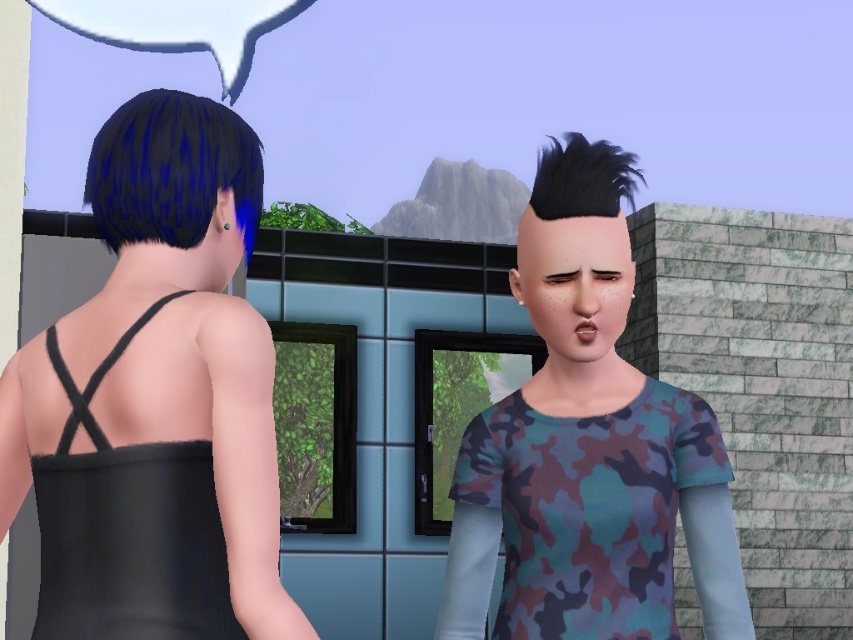
Question: Which object is the closest to the white paper speech bubble at upper center?

Choices:
 (A) black matte hair at upper center
 (B) blue shiny hair at back
 (C) camouflage fabric at center
 (D) black matte dress at left

Answer: (A)

Question: Which point appears farthest from the camera in this image?

Choices:
 (A) (598, 529)
 (B) (631, 616)
 (C) (222, 250)

Answer: (A)

Question: Does camouflage fabric at center appear on the right side of blue shiny hair at back?

Choices:
 (A) no
 (B) yes

Answer: (B)

Question: Does black matte dress at back have a smaller size compared to blue shiny hair at back?

Choices:
 (A) no
 (B) yes

Answer: (B)

Question: Based on their relative distances, which object is farther from the black matte hair at upper center?

Choices:
 (A) black matte dress at left
 (B) black matte dress at back

Answer: (B)

Question: Is camouflage fabric at center positioned in front of white paper speech bubble at upper center?

Choices:
 (A) no
 (B) yes

Answer: (B)